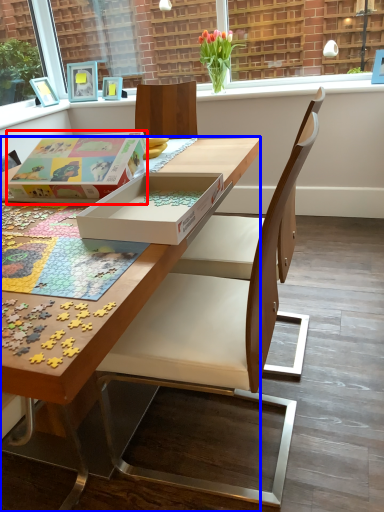
Question: Which object is closer to the camera taking this photo, cardboard box (highlighted by a red box) or desk (highlighted by a blue box)?

Choices:
 (A) cardboard box
 (B) desk

Answer: (B)